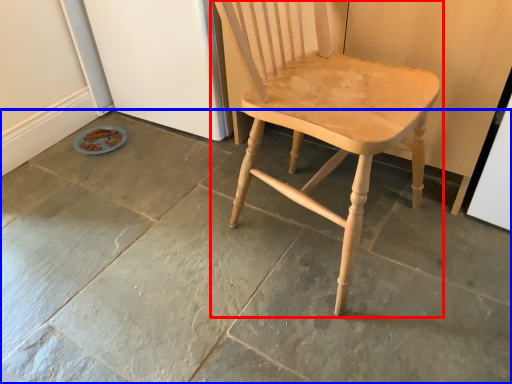
Question: Which object is closer to the camera taking this photo, chair (highlighted by a red box) or concrete (highlighted by a blue box)?

Choices:
 (A) chair
 (B) concrete

Answer: (A)